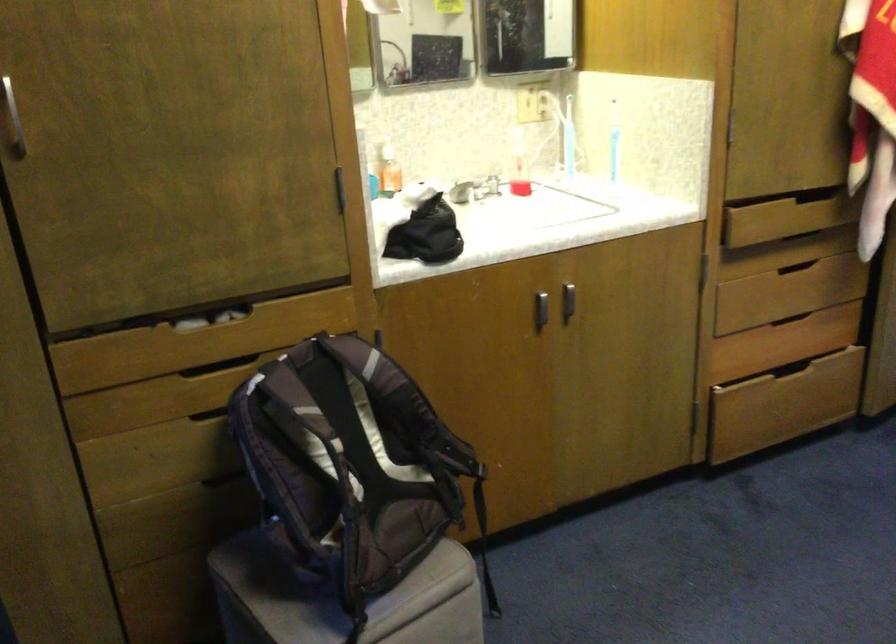
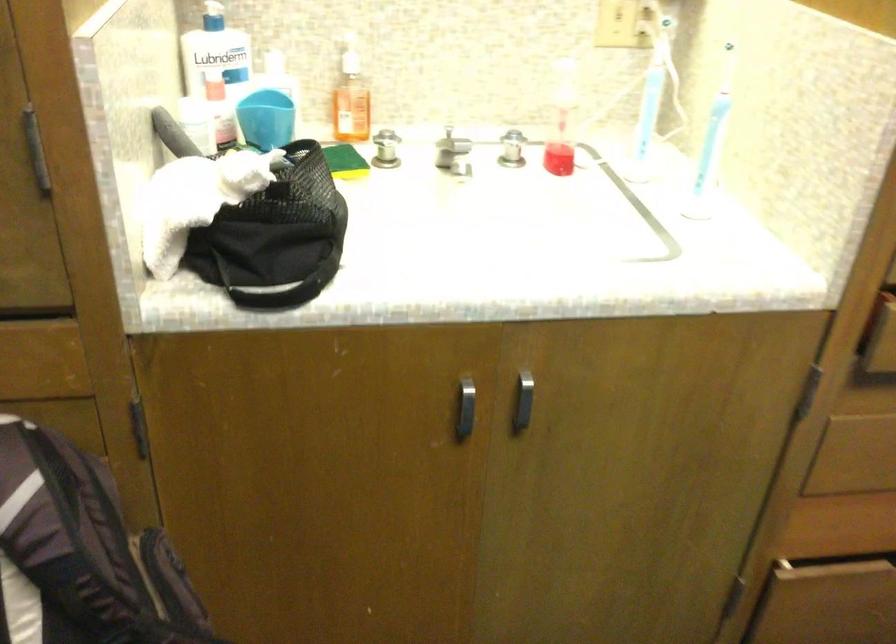
Question: Based on the continuous images, in which direction is the camera rotating? Reply with the corresponding letter.

Choices:
 (A) Left
 (B) Right
 (C) Up
 (D) Down

Answer: (D)